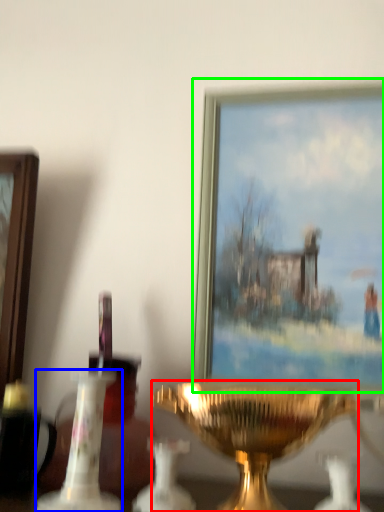
Question: Estimate the real-world distances between objects in this image. Which object is farther from candle holder (highlighted by a red box), candle holder (highlighted by a blue box) or picture frame (highlighted by a green box)?

Choices:
 (A) candle holder
 (B) picture frame

Answer: (B)